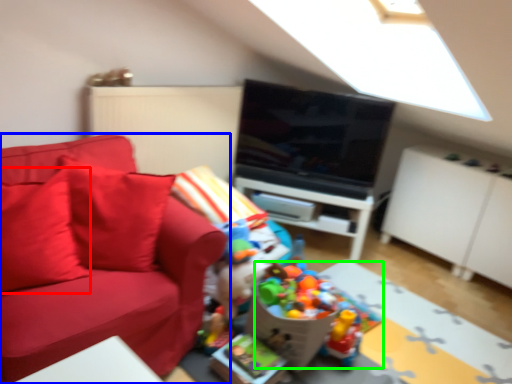
Question: Which is nearer to the pillow (highlighted by a red box)? studio couch (highlighted by a blue box) or toy (highlighted by a green box).

Choices:
 (A) studio couch
 (B) toy

Answer: (A)